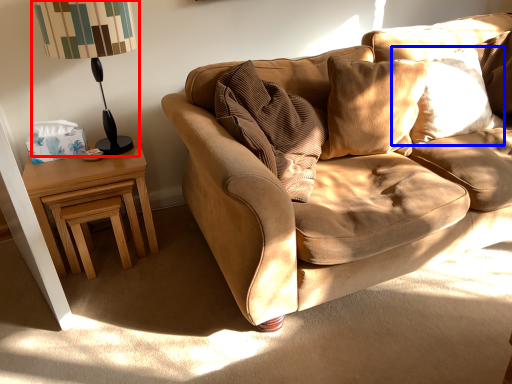
Question: Which point is further to the camera, table lamp (highlighted by a red box) or pillow (highlighted by a blue box)?

Choices:
 (A) table lamp
 (B) pillow

Answer: (B)